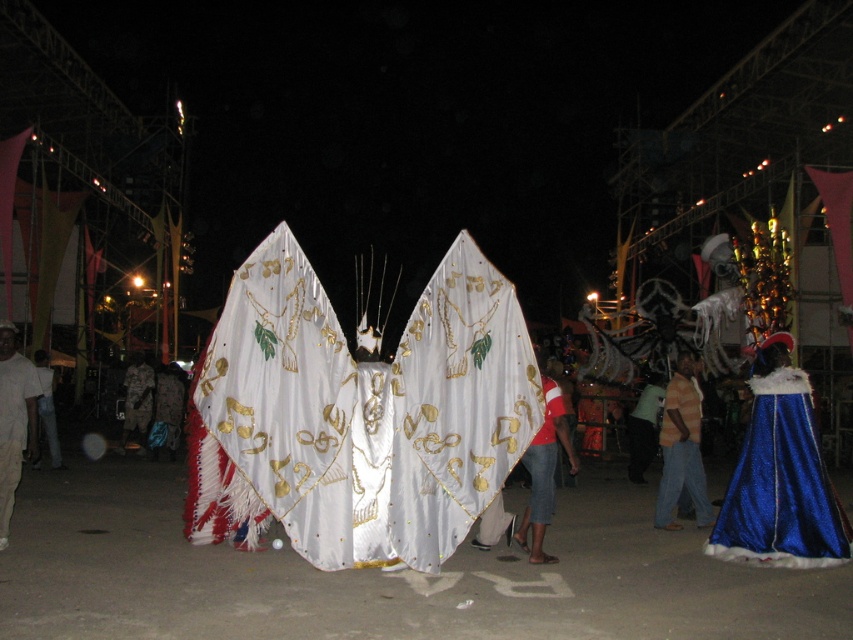
Does white satin flag at center have a greater width compared to camouflage fabric pants at lower left?

No, white satin flag at center is not wider than camouflage fabric pants at lower left.

Is point (550, 390) positioned before point (161, 378)?

Yes, it is.

The width and height of the screenshot is (853, 640). In order to click on white satin flag at center in this screenshot , I will do `click(544, 472)`.

Can you confirm if striped shirt at center is taller than white cotton shirt at left?

No, striped shirt at center is not taller than white cotton shirt at left.

Does point (699, 404) come in front of point (22, 442)?

No, (699, 404) is behind (22, 442).

Find the location of `striped shirt at center`. striped shirt at center is located at coordinates (682, 449).

In the scene shown: Who is higher up, white cotton shirt at left or camouflage fabric pants at lower left?

white cotton shirt at left

This screenshot has height=640, width=853. What are the coordinates of `white cotton shirt at left` in the screenshot? It's located at click(x=15, y=419).

The image size is (853, 640). Describe the element at coordinates (15, 419) in the screenshot. I see `white cotton shirt at left` at that location.

Locate an element on the screen. The image size is (853, 640). white cotton shirt at left is located at coordinates (15, 419).